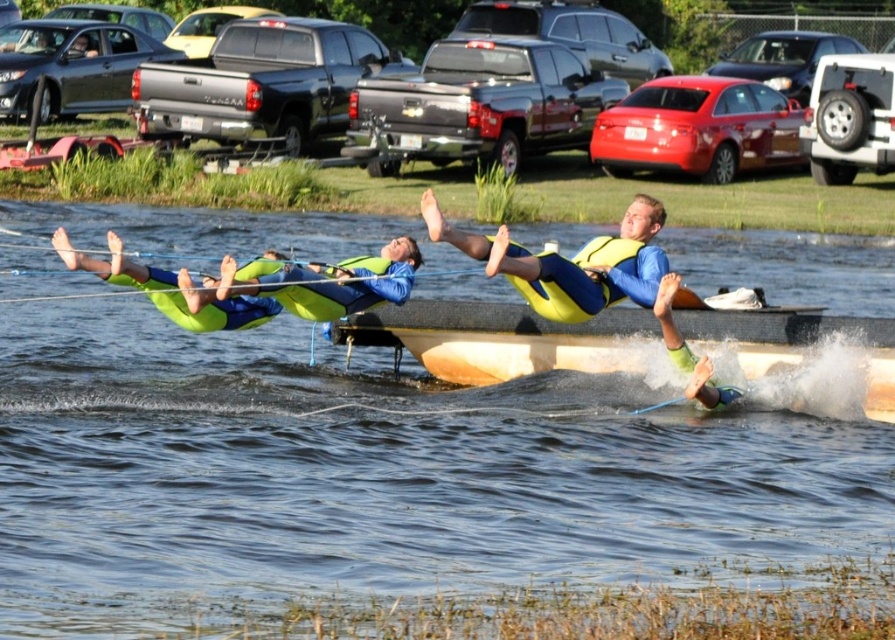
Question: From the image, what is the correct spatial relationship of wooden boat at center in relation to green neoprene life vest at center?

Choices:
 (A) below
 (B) above

Answer: (A)

Question: Can you confirm if wooden boat at center is positioned to the left of yellow life vest at center?

Choices:
 (A) no
 (B) yes

Answer: (A)

Question: Which point appears farthest from the camera in this image?

Choices:
 (A) (682, 314)
 (B) (800, 240)
 (C) (537, 305)
 (D) (251, 314)

Answer: (B)

Question: Estimate the real-world distances between objects in this image. Which object is farther from the yellow life vest at center?

Choices:
 (A) green neoprene life vest at center
 (B) clear water at center
 (C) wooden boat at center

Answer: (B)

Question: Which point is closer to the camera?

Choices:
 (A) yellow life vest at center
 (B) green neoprene life vest at center

Answer: (A)

Question: Is clear water at center above wooden boat at center?

Choices:
 (A) no
 (B) yes

Answer: (B)